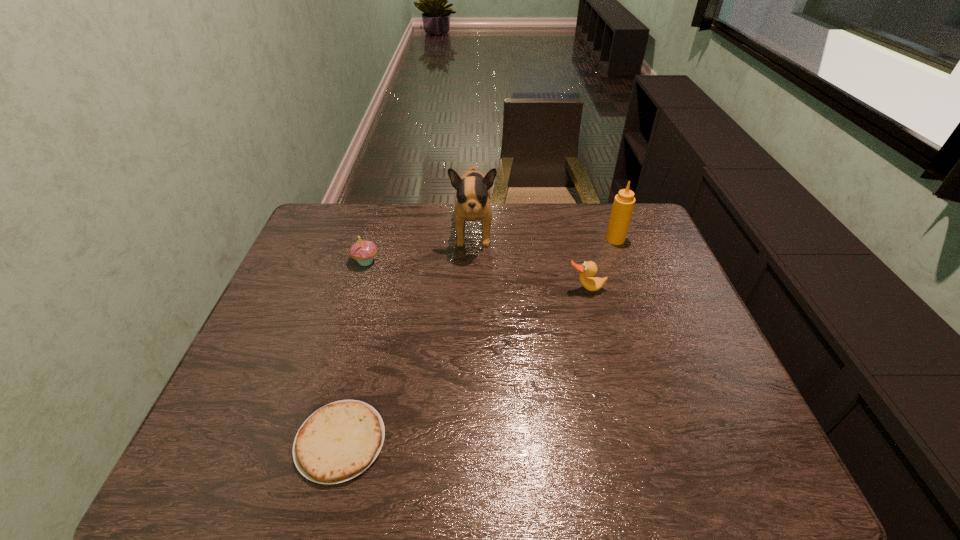
Identify the location of vacant space at the near edge of the desktop. (280, 471).

Locate an element on the screen. Image resolution: width=960 pixels, height=540 pixels. vacant area at the left edge of the desktop is located at coordinates (333, 264).

I want to click on free space at the right edge of the desktop, so click(668, 262).

Locate an element on the screen. vacant space at the far right corner of the desktop is located at coordinates (638, 214).

Where is `vacant space at the near right corner of the desktop`? This screenshot has height=540, width=960. vacant space at the near right corner of the desktop is located at coordinates (712, 462).

What are the coordinates of `vacant point located between the rightmost object and the puppy` in the screenshot? It's located at (544, 235).

This screenshot has height=540, width=960. I want to click on vacant area between the fourth shortest object and the tortilla, so click(478, 340).

You are a GUI agent. You are given a task and a screenshot of the screen. Output one action in this format:
    pyautogui.click(x=<x>, y=<y>)
    Task: Click on the vacant point located between the nearest object and the cupcake
    The width and height of the screenshot is (960, 540).
    Given the screenshot: What is the action you would take?
    pyautogui.click(x=353, y=352)

At what (x,y) coordinates should I click in order to perform the action: click on free space between the fourth shortest object and the third object from left to right. Please return your answer as a coordinate pair (x, y). This screenshot has height=540, width=960. Looking at the image, I should click on (544, 235).

Where is `vacant space that's between the third object from left to right and the duck`? The image size is (960, 540). vacant space that's between the third object from left to right and the duck is located at coordinates (530, 260).